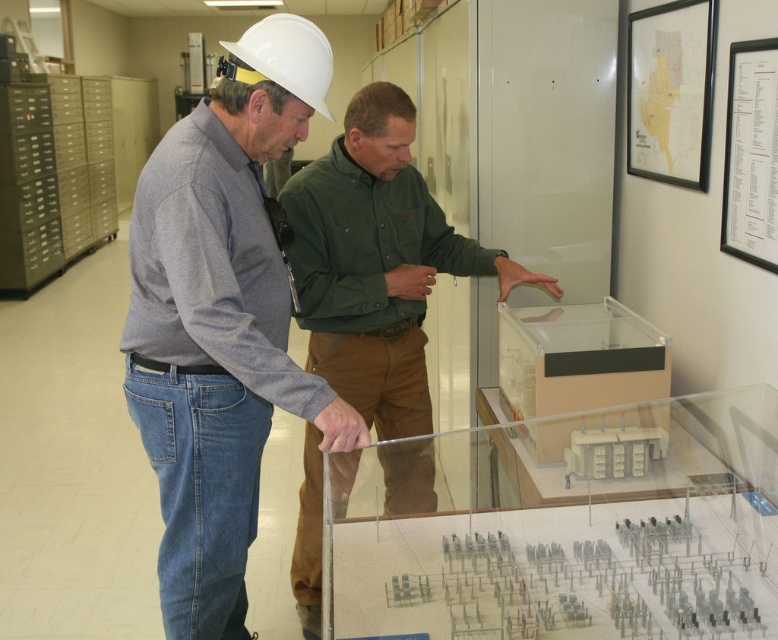
Who is taller, matte gray shirt at center or white hard hat at upper center?

matte gray shirt at center

You are a GUI agent. You are given a task and a screenshot of the screen. Output one action in this format:
    pyautogui.click(x=<x>, y=<y>)
    Task: Click on the matte gray shirt at center
    Image resolution: width=778 pixels, height=640 pixels.
    Given the screenshot: What is the action you would take?
    pyautogui.click(x=221, y=320)

Can you confirm if green matte shirt at center is thinner than white hard hat at upper center?

No, green matte shirt at center is not thinner than white hard hat at upper center.

Between green matte shirt at center and white hard hat at upper center, which one is positioned lower?

green matte shirt at center

Locate an element on the screen. The height and width of the screenshot is (640, 778). green matte shirt at center is located at coordinates (377, 262).

Who is more forward, (279, 369) or (363, 115)?

Point (279, 369) is more forward.

Is matte gray shirt at center bigger than green matte shirt at center?

No.

This screenshot has width=778, height=640. In order to click on matte gray shirt at center in this screenshot , I will do (221, 320).

Find the location of a particular element. The image size is (778, 640). matte gray shirt at center is located at coordinates (221, 320).